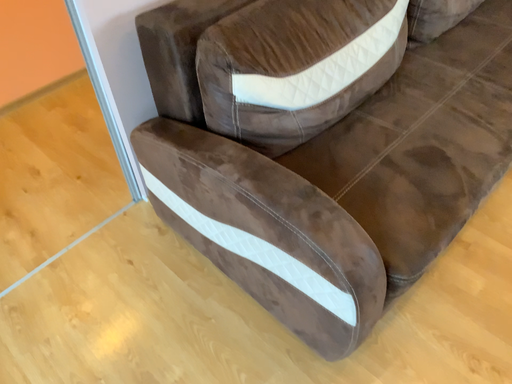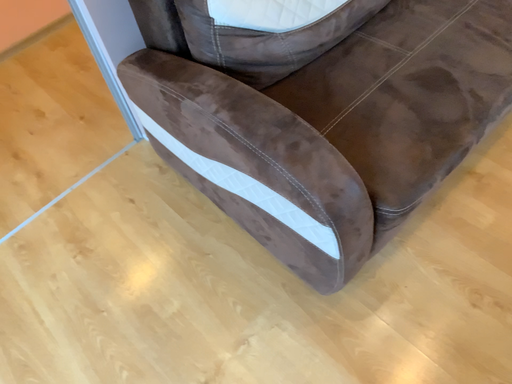
Question: How did the camera likely rotate when shooting the video?

Choices:
 (A) rotated downward
 (B) rotated upward

Answer: (A)